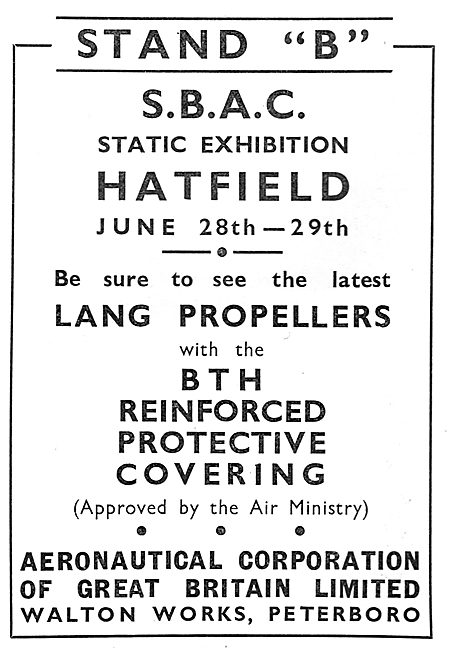
The image size is (451, 650). Identify the location of corners. (385, 541), (22, 58), (417, 630), (22, 630), (422, 62).